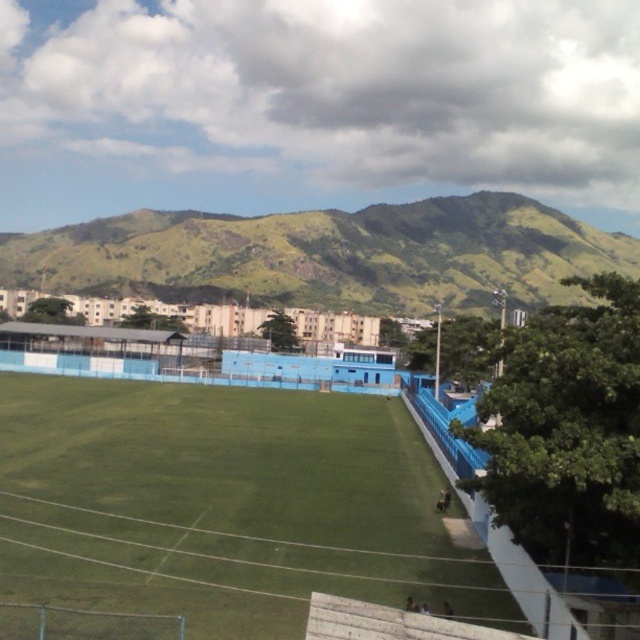
You are a drone operator who needs to fly a drone from the green grass football field at center to the green grassy hill at upper center. The drone has a maximum flight range of 150 meters. Based on the scene, can the drone make the trip without needing to recharge?

The distance between the green grass football field at center and the green grassy hill at upper center is 141.55 meters, which is within the drone operator maximum flight range of 150 meters. The drone can make the trip without needing to recharge.

You are a photographer planning to take a photo of the green grass football field at center and the green grassy hill at upper center. Which object will appear closer to the camera in the final photo?

The green grass football field at center will appear closer to the camera in the final photo because it is positioned in front of the green grassy hill at upper center.

You are a drone operator trying to capture aerial footage of the green grass football field at center and the green grassy hill at upper center. Which object will appear larger in your camera view?

The green grass football field at center will appear larger in the camera view because it is physically smaller than the green grassy hill at upper center, but since it is closer to the camera, it occupies more space in the frame.